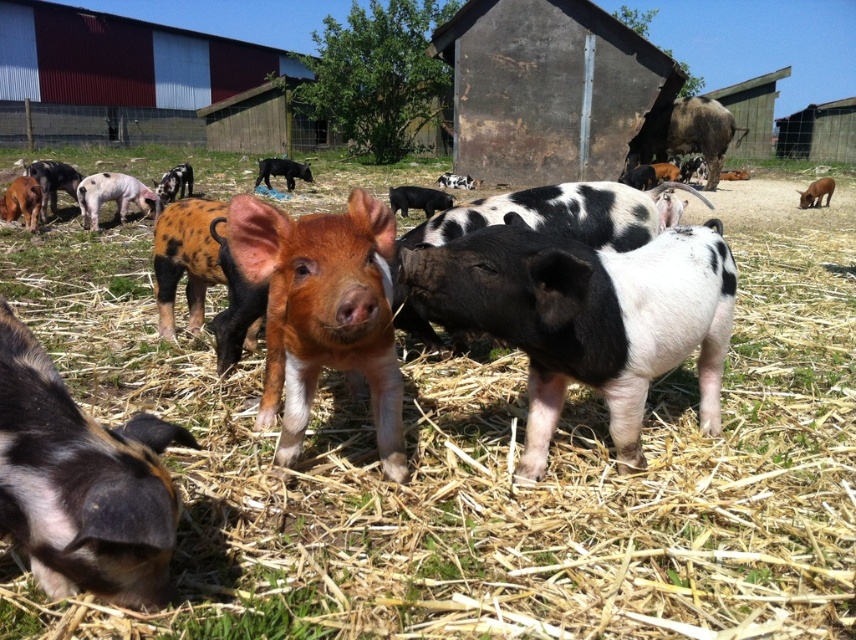
You are a farmer trying to identify piglets in the image. You notice two piglets at the upper right corner. Which one is closer to you, the brown textured pig at upper right or the brown fuzzy piglet at upper right?

The brown textured pig at upper right is closer to you because the brown fuzzy piglet at upper right is behind it.

You are a farmer checking the piglets in the farmyard. You notice the black and white speckled pig at center and the white speckled piglet at left. Which pig is taller?

The black and white speckled pig at center is much taller than the white speckled piglet at left.

Based on the photo, you are a farmer checking the piglets in the farmyard. You notice two pigs at the upper right corner of the image. Which one is positioned higher between the brown textured pig at upper right and the brown fuzzy piglet at upper right?

The brown textured pig at upper right is positioned higher than the brown fuzzy piglet at upper right.